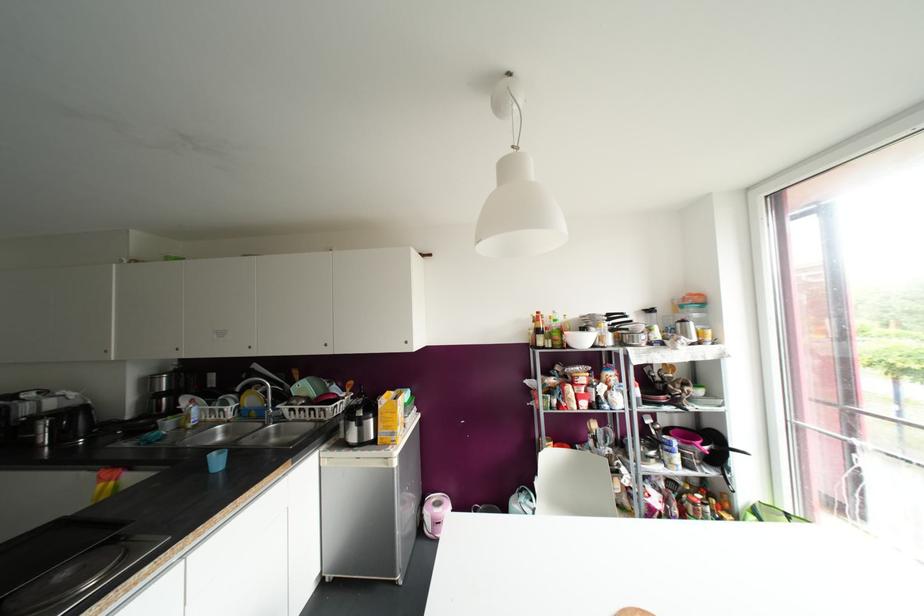
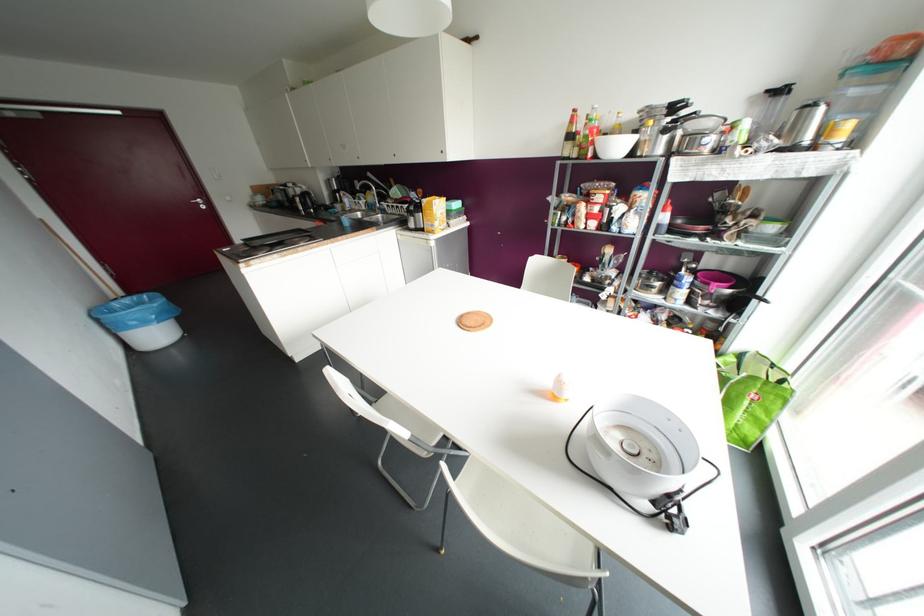
In the second image, find the point that corresponds to point 379,406 in the first image.

(421, 204)